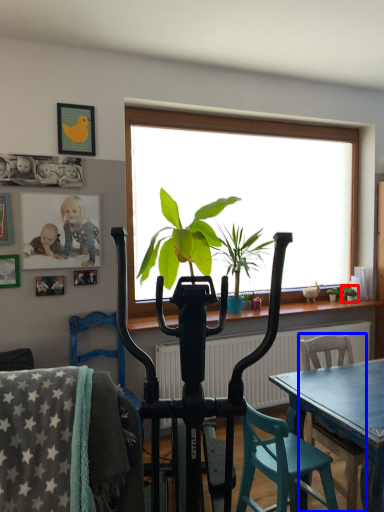
Question: Which point is further to the camera, houseplant (highlighted by a red box) or chair (highlighted by a blue box)?

Choices:
 (A) houseplant
 (B) chair

Answer: (A)